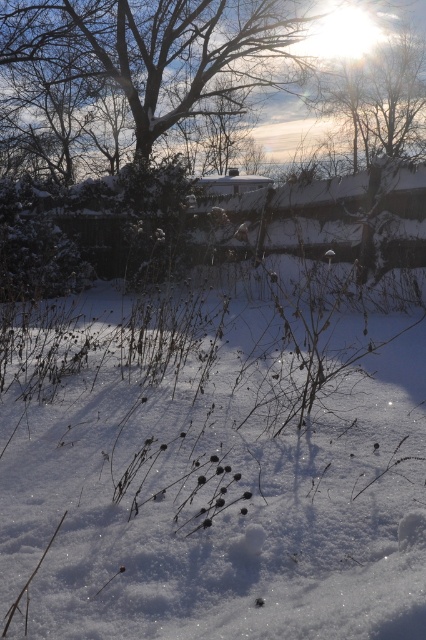
In the scene shown: You are an observer standing in the winter scene. You notice the white fluffy snow at center and the bare branches at upper center. Which object is nearer to you?

The white fluffy snow at center is closer to the viewer than the bare branches at upper center.

You are a bird flying over the winter scene. You want to land on the nearest object to rest. Which object would you choose between the white fluffy snow at center and the bare branches at upper center?

The white fluffy snow at center is 16.01 meters away from the bare branches at upper center. Since the snow is closer to the branches than the branches are to the bird, the bird should land on the white fluffy snow at center as it is nearer.

You are an observer looking at the winter scene. You notice the white fluffy snow at center and the bare branches at upper center. Which of these two elements is taller in the image?

The bare branches at upper center are taller than the white fluffy snow at center.